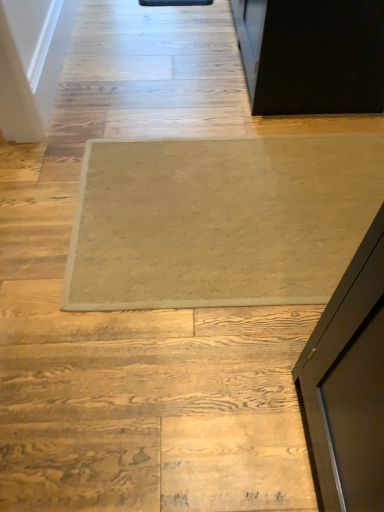
The image size is (384, 512). I want to click on vacant space in front of beige carpet at center, so click(183, 391).